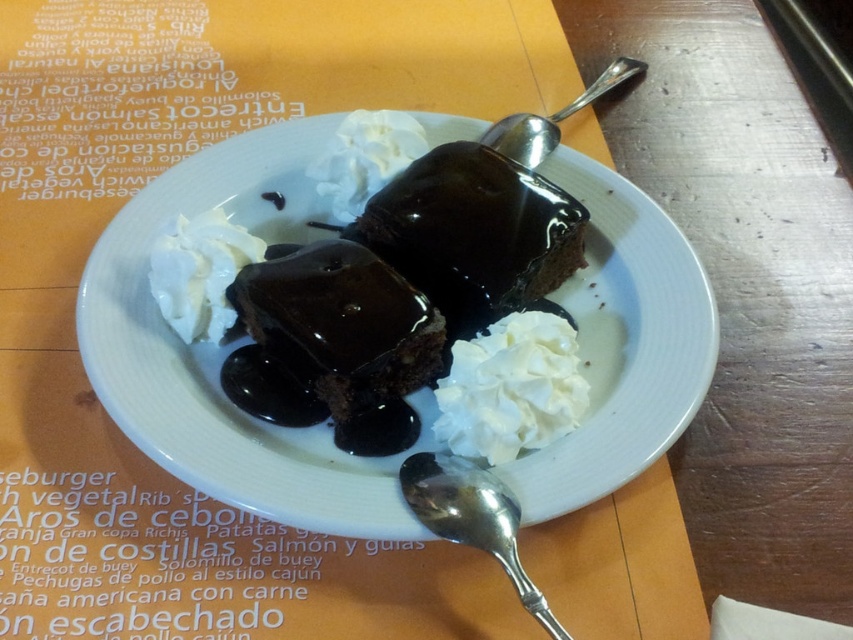
Question: Observing the image, what is the correct spatial positioning of white glossy plate at center in reference to white creamy whipped cream at center?

Choices:
 (A) right
 (B) left

Answer: (B)

Question: Is white creamy whipped cream at center smaller than silver metallic spoon at lower center?

Choices:
 (A) no
 (B) yes

Answer: (B)

Question: Among these points, which one is nearest to the camera?

Choices:
 (A) (207, 220)
 (B) (502, 136)

Answer: (A)

Question: Does silver metallic spoon at lower center appear under silver metallic spoon at upper center?

Choices:
 (A) no
 (B) yes

Answer: (B)

Question: Which of these objects is positioned closest to the shiny dark chocolate cake at center?

Choices:
 (A) glossy chocolate cake at center
 (B) silver metallic spoon at lower center
 (C) white fluffy whipped cream at upper center

Answer: (A)

Question: Which object is positioned farthest from the white creamy whipped cream at center?

Choices:
 (A) silver metallic spoon at lower center
 (B) shiny dark chocolate cake at center
 (C) white glossy plate at center
 (D) glossy chocolate cake at center

Answer: (B)